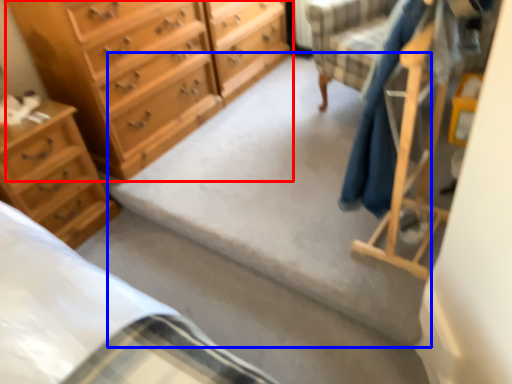
Question: Which object is closer to the camera taking this photo, chest of drawers (highlighted by a red box) or concrete (highlighted by a blue box)?

Choices:
 (A) chest of drawers
 (B) concrete

Answer: (B)